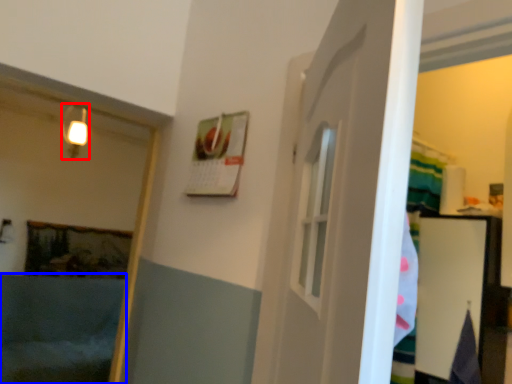
Question: Which of the following is the farthest to the observer, light fixture (highlighted by a red box) or bath (highlighted by a blue box)?

Choices:
 (A) light fixture
 (B) bath

Answer: (A)